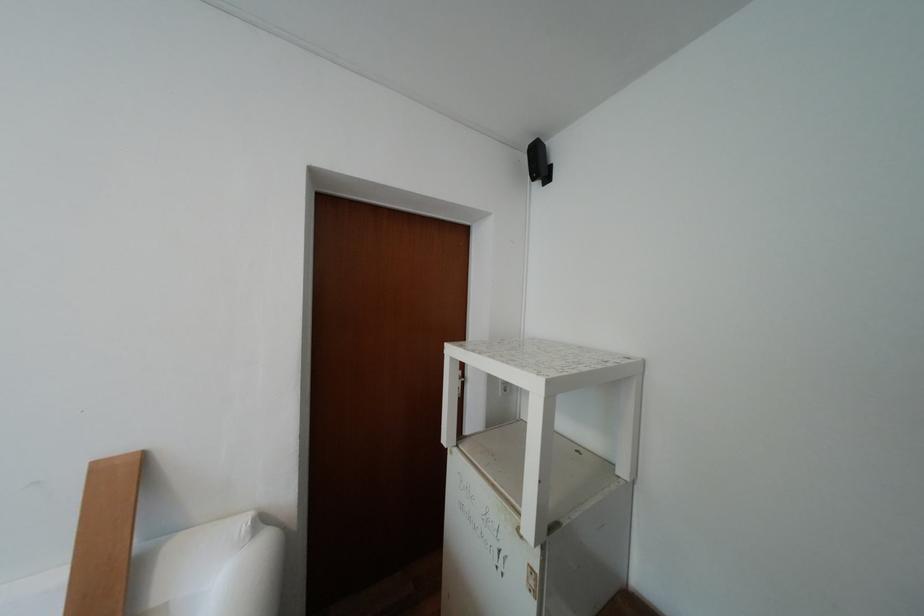
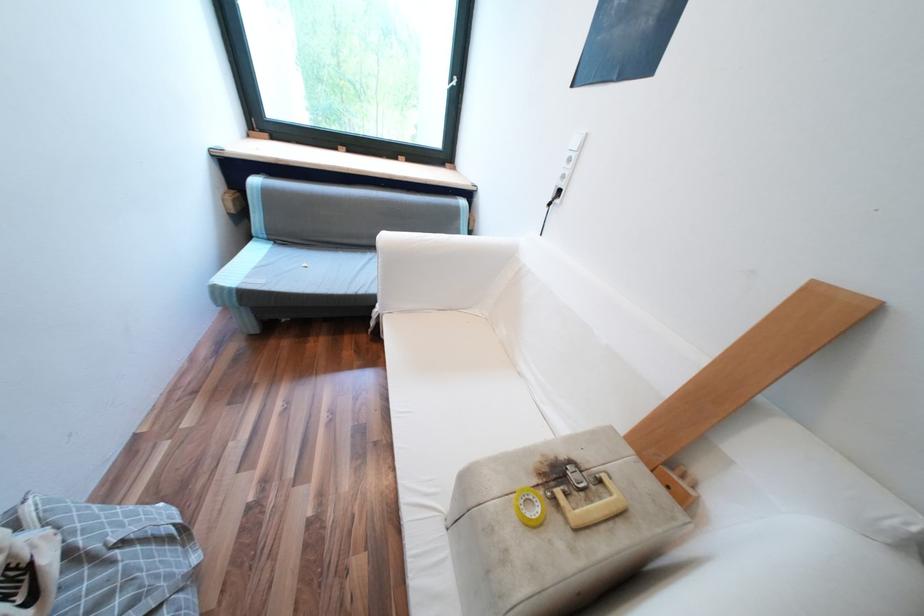
The images are taken continuously from a first-person perspective. In which direction is your viewpoint rotating?

The camera's rotation is toward left-down.